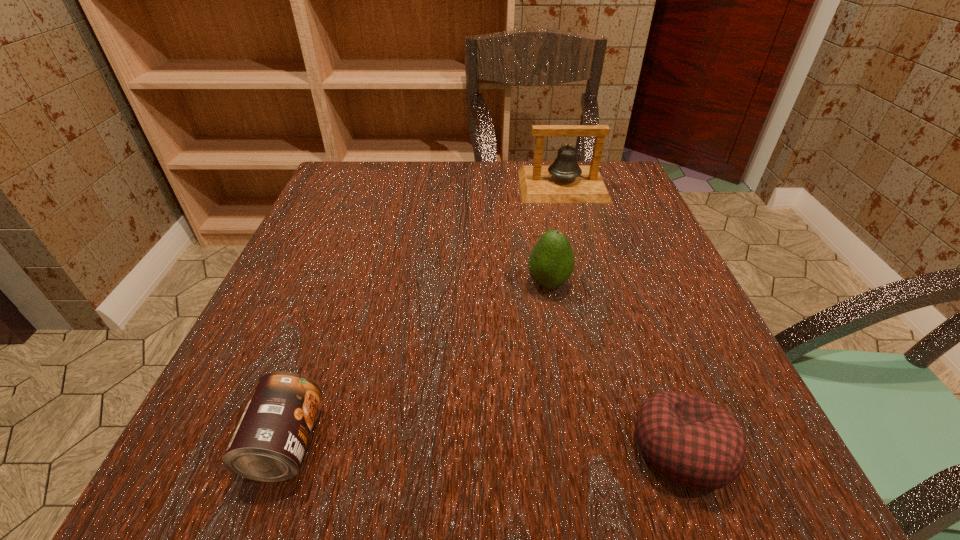
In the image, there is a desktop. Where is `vacant area at the left edge`? vacant area at the left edge is located at coordinates (323, 404).

Where is `blank space at the right edge of the desktop`? Image resolution: width=960 pixels, height=540 pixels. blank space at the right edge of the desktop is located at coordinates (744, 424).

This screenshot has width=960, height=540. I want to click on vacant space at the far left corner, so click(366, 199).

Image resolution: width=960 pixels, height=540 pixels. I want to click on vacant region at the near left corner, so click(x=182, y=464).

This screenshot has height=540, width=960. What are the coordinates of `vacant space at the far right corner of the desktop` in the screenshot? It's located at (634, 203).

In order to click on free space between the leftmost object and the bell in this screenshot , I will do `click(424, 314)`.

At what (x,y) coordinates should I click in order to perform the action: click on free space that is in between the leftmost object and the beanbag. Please return your answer as a coordinate pair (x, y). The width and height of the screenshot is (960, 540). Looking at the image, I should click on (484, 446).

I want to click on vacant space that is in between the can and the third nearest object, so 417,363.

Identify the location of vacant space that's between the leftmost object and the beanbag. click(x=484, y=446).

The width and height of the screenshot is (960, 540). I want to click on vacant space that's between the farthest object and the beanbag, so click(x=622, y=317).